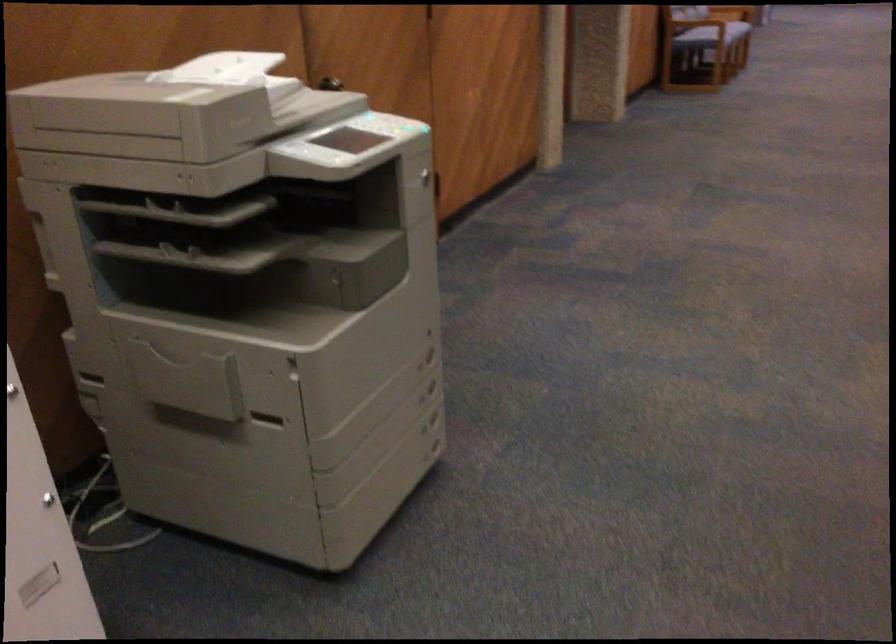
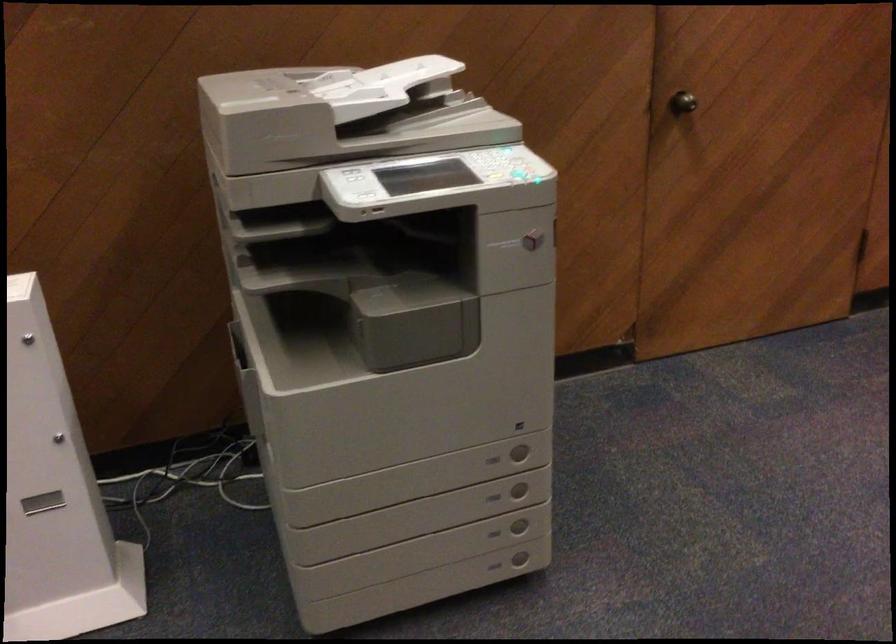
Find the pixel in the second image that matches (226,80) in the first image.

(437, 86)